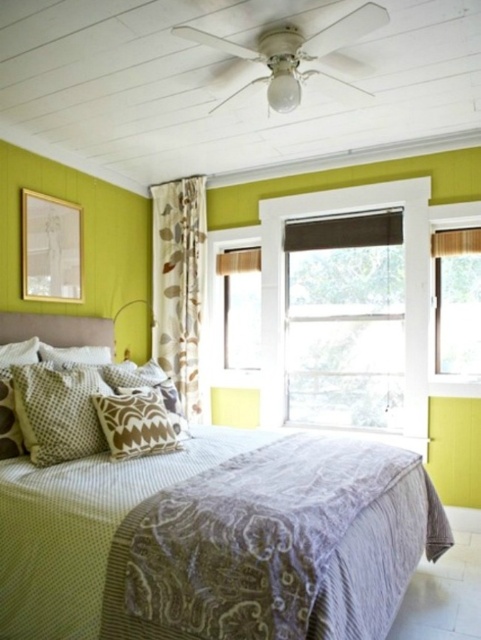
You are standing in the bedroom and want to open the window to let some fresh air in. The window is located at the point with coordinates (455, 326). What object is blocking your view of the window?

The point at coordinates (455, 326) is where the matte brown curtain at right is located, so the matte brown curtain at right is blocking your view of the window.

You are standing in the middle of the room and want to walk to the window behind the matte brown curtain at right. Which direction should you move relative to the textured beige bed at center?

Since the textured beige bed at center is to the left of the matte brown curtain at right, you should move to the right of the textured beige bed at center to reach the matte brown curtain at right and the window behind it.